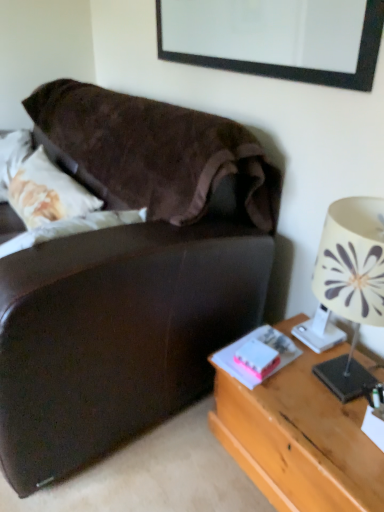
Identify the location of vacant area that is situated to the right of white matte book at lower right, the 1th book viewed from the left. The image size is (384, 512). (315, 373).